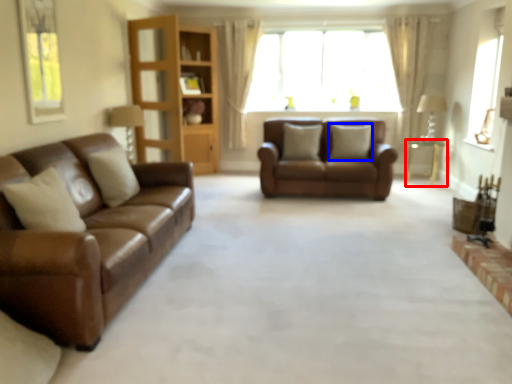
Question: Which of the following is the closest to the observer, table (highlighted by a red box) or pillow (highlighted by a blue box)?

Choices:
 (A) table
 (B) pillow

Answer: (B)